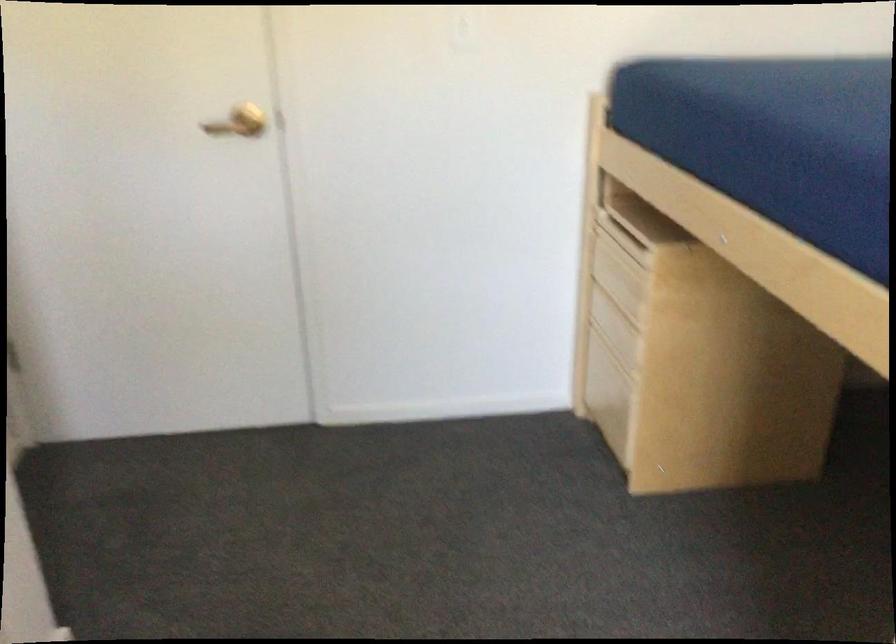
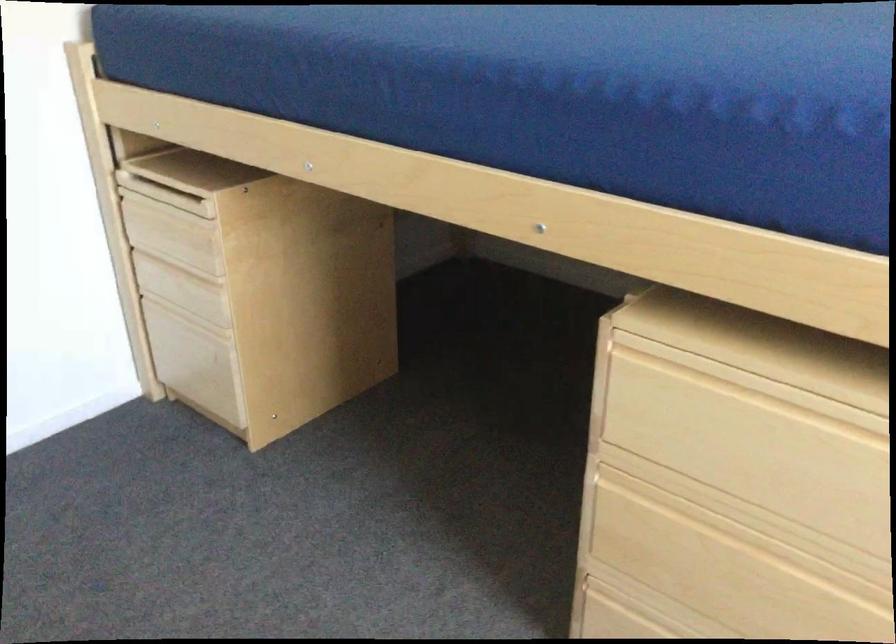
In the second image, find the point that corresponds to (x=606, y=389) in the first image.

(195, 361)